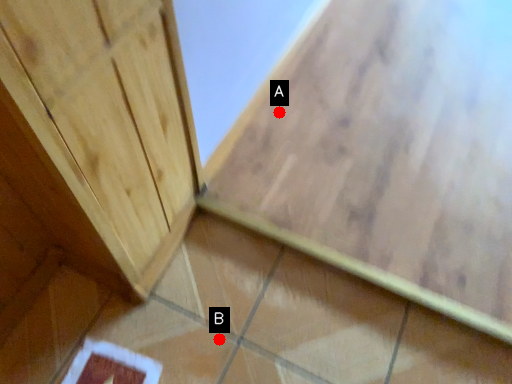
Question: Two points are circled on the image, labeled by A and B beside each circle. Which point is closer to the camera taking this photo?

Choices:
 (A) A is closer
 (B) B is closer

Answer: (B)